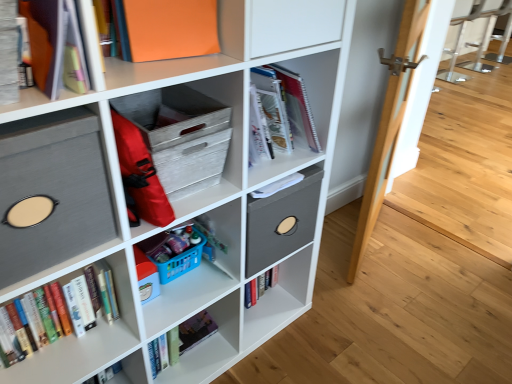
The image size is (512, 384). Describe the element at coordinates (53, 190) in the screenshot. I see `gray fabric storage bin at left, placed as the second shelf when sorted from bottom to top` at that location.

What is the approximate width of wooden crate at center, placed as the second shelf when sorted from top to bottom?

It is 35.37 centimeters.

What is the approximate height of wooden crate at center, acting as the third shelf starting from the bottom?

21.55 centimeters.

The image size is (512, 384). Identify the location of orange matte paper at upper center. (170, 28).

Find the location of a particular element. gray fabric storage bin at left, placed as the second shelf when sorted from bottom to top is located at coordinates (53, 190).

How many degrees apart are the facing directions of matte orange folder at upper left, the first shelf viewed from the top, and orange matte paper at upper center?

17.2 degrees.

Which object is thinner, matte orange folder at upper left, marked as the 4th shelf in a bottom-to-top arrangement, or orange matte paper at upper center?

Thinner between the two is orange matte paper at upper center.

Considering the positions of objects matte orange folder at upper left, the first shelf viewed from the top, and orange matte paper at upper center in the image provided, who is more to the right, matte orange folder at upper left, the first shelf viewed from the top, or orange matte paper at upper center?

orange matte paper at upper center.

Which of these two, matte orange folder at upper left, the first shelf viewed from the top, or orange matte paper at upper center, is smaller?

orange matte paper at upper center is smaller.

Which is more to the right, wooden crate at center, placed as the second shelf when sorted from top to bottom, or gray fabric storage bin at left, placed as the second shelf when sorted from bottom to top?

Positioned to the right is wooden crate at center, placed as the second shelf when sorted from top to bottom.

Considering the sizes of objects wooden crate at center, acting as the third shelf starting from the bottom, and gray fabric storage bin at left, placed as the second shelf when sorted from bottom to top, in the image provided, who is bigger, wooden crate at center, acting as the third shelf starting from the bottom, or gray fabric storage bin at left, placed as the second shelf when sorted from bottom to top,?

Bigger between the two is gray fabric storage bin at left, placed as the second shelf when sorted from bottom to top.

Could you tell me if wooden crate at center, placed as the second shelf when sorted from top to bottom, is turned towards gray fabric storage bin at left, placed as the second shelf when sorted from bottom to top?

No, wooden crate at center, placed as the second shelf when sorted from top to bottom, is not aimed at gray fabric storage bin at left, placed as the second shelf when sorted from bottom to top.

In terms of size, does orange matte paper at upper center appear bigger or smaller than wooden crate at center, placed as the second shelf when sorted from top to bottom?

In the image, orange matte paper at upper center appears to be smaller than wooden crate at center, placed as the second shelf when sorted from top to bottom.

Considering the sizes of orange matte paper at upper center and wooden crate at center, acting as the third shelf starting from the bottom, in the image, is orange matte paper at upper center wider or thinner than wooden crate at center, acting as the third shelf starting from the bottom,?

In the image, orange matte paper at upper center appears to be more narrow than wooden crate at center, acting as the third shelf starting from the bottom.

Consider the image. Can you tell me how much orange matte paper at upper center and wooden crate at center, acting as the third shelf starting from the bottom, differ in facing direction?

The angle between the facing direction of orange matte paper at upper center and the facing direction of wooden crate at center, acting as the third shelf starting from the bottom, is 18.8 degrees.

Considering the relative sizes of gray fabric storage bin at left, which ranks as the third shelf in top-to-bottom order, and matte gray fabric storage cube at upper left, arranged as the first shelf when ordered from the bottom, in the image provided, is gray fabric storage bin at left, which ranks as the third shelf in top-to-bottom order, wider than matte gray fabric storage cube at upper left, arranged as the first shelf when ordered from the bottom,?

Incorrect, the width of gray fabric storage bin at left, which ranks as the third shelf in top-to-bottom order, does not surpass that of matte gray fabric storage cube at upper left, arranged as the first shelf when ordered from the bottom.

From the image's perspective, is gray fabric storage bin at left, which ranks as the third shelf in top-to-bottom order, below matte gray fabric storage cube at upper left, arranged as the first shelf when ordered from the bottom?

No, from the image's perspective, gray fabric storage bin at left, which ranks as the third shelf in top-to-bottom order, is not beneath matte gray fabric storage cube at upper left, arranged as the first shelf when ordered from the bottom.

Who is more distant, gray fabric storage bin at left, placed as the second shelf when sorted from bottom to top, or matte gray fabric storage cube at upper left, the fourth shelf in the top-to-bottom sequence?

gray fabric storage bin at left, placed as the second shelf when sorted from bottom to top, is behind.

How distant is gray fabric storage bin at left, which ranks as the third shelf in top-to-bottom order, from matte gray fabric storage cube at upper left, the fourth shelf in the top-to-bottom sequence?

gray fabric storage bin at left, which ranks as the third shelf in top-to-bottom order, is 25.41 centimeters from matte gray fabric storage cube at upper left, the fourth shelf in the top-to-bottom sequence.

This screenshot has width=512, height=384. Identify the location of the 3rd shelf above the matte gray fabric storage cube at upper left, arranged as the first shelf when ordered from the bottom (from a real-world perspective). (65, 90).

Does matte orange folder at upper left, marked as the 4th shelf in a bottom-to-top arrangement, touch matte gray fabric storage cube at upper left, the fourth shelf in the top-to-bottom sequence?

matte orange folder at upper left, marked as the 4th shelf in a bottom-to-top arrangement, and matte gray fabric storage cube at upper left, the fourth shelf in the top-to-bottom sequence, are not in contact.

Who is taller, matte orange folder at upper left, marked as the 4th shelf in a bottom-to-top arrangement, or matte gray fabric storage cube at upper left, arranged as the first shelf when ordered from the bottom?

Standing taller between the two is matte gray fabric storage cube at upper left, arranged as the first shelf when ordered from the bottom.

From the image's perspective, between matte orange folder at upper left, the first shelf viewed from the top, and matte gray fabric storage cube at upper left, the fourth shelf in the top-to-bottom sequence, who is located below?

matte gray fabric storage cube at upper left, the fourth shelf in the top-to-bottom sequence.

Between hardcover books at left and orange matte paper at upper center, which one has larger width?

Wider between the two is hardcover books at left.

How many degrees apart are the facing directions of hardcover books at left and orange matte paper at upper center?

18.6 degrees separate the facing orientations of hardcover books at left and orange matte paper at upper center.

Is point (14, 321) positioned in front of point (209, 0)?

No, (14, 321) is behind (209, 0).

Is hardcover books at left turned away from orange matte paper at upper center?

That's not correct — hardcover books at left is not looking away from orange matte paper at upper center.

From the image's perspective, is gray fabric storage bin at left, placed as the second shelf when sorted from bottom to top, located above wooden crate at center, placed as the second shelf when sorted from top to bottom?

Actually, gray fabric storage bin at left, placed as the second shelf when sorted from bottom to top, appears below wooden crate at center, placed as the second shelf when sorted from top to bottom, in the image.

Is gray fabric storage bin at left, which ranks as the third shelf in top-to-bottom order, positioned with its back to wooden crate at center, placed as the second shelf when sorted from top to bottom?

No, gray fabric storage bin at left, which ranks as the third shelf in top-to-bottom order, is not facing the opposite direction of wooden crate at center, placed as the second shelf when sorted from top to bottom.

From the picture: From a real-world perspective, is gray fabric storage bin at left, which ranks as the third shelf in top-to-bottom order, physically located above or below wooden crate at center, placed as the second shelf when sorted from top to bottom?

From a real-world perspective, gray fabric storage bin at left, which ranks as the third shelf in top-to-bottom order, is physically above wooden crate at center, placed as the second shelf when sorted from top to bottom.

Locate an element on the screen. paperback book above the matte orange folder at upper left, the first shelf viewed from the top (from a real-world perspective) is located at coordinates (170, 28).

Identify the location of the 3rd shelf to the right of the gray fabric storage bin at left, placed as the second shelf when sorted from bottom to top, starting your count from the anchor. The width and height of the screenshot is (512, 384). (191, 136).

Based on their spatial positions, is matte orange folder at upper left, the first shelf viewed from the top, or orange matte paper at upper center closer to matte gray fabric storage cube at upper left, arranged as the first shelf when ordered from the bottom?

orange matte paper at upper center is positioned closer to the anchor matte gray fabric storage cube at upper left, arranged as the first shelf when ordered from the bottom.

Which object lies nearer to the anchor point gray fabric storage bin at left, placed as the second shelf when sorted from bottom to top, matte orange folder at upper left, the first shelf viewed from the top, or hardcover books at left?

Based on the image, matte orange folder at upper left, the first shelf viewed from the top, appears to be nearer to gray fabric storage bin at left, placed as the second shelf when sorted from bottom to top.

From the image, which object appears to be nearer to gray fabric storage bin at left, which ranks as the third shelf in top-to-bottom order, wooden crate at center, acting as the third shelf starting from the bottom, or hardcover books at left?

Result: wooden crate at center, acting as the third shelf starting from the bottom, is closer to gray fabric storage bin at left, which ranks as the third shelf in top-to-bottom order.

When comparing their distances from wooden crate at center, acting as the third shelf starting from the bottom, does orange matte paper at upper center or matte gray fabric storage cube at upper left, arranged as the first shelf when ordered from the bottom, seem closer?

The object closer to wooden crate at center, acting as the third shelf starting from the bottom, is matte gray fabric storage cube at upper left, arranged as the first shelf when ordered from the bottom.

Based on their spatial positions, is gray fabric storage bin at left, which ranks as the third shelf in top-to-bottom order, or matte orange folder at upper left, marked as the 4th shelf in a bottom-to-top arrangement, further from wooden crate at center, acting as the third shelf starting from the bottom?

matte orange folder at upper left, marked as the 4th shelf in a bottom-to-top arrangement, is further to wooden crate at center, acting as the third shelf starting from the bottom.

Estimate the real-world distances between objects in this image. Which object is further from gray fabric storage bin at left, placed as the second shelf when sorted from bottom to top, wooden crate at center, acting as the third shelf starting from the bottom, or matte orange folder at upper left, the first shelf viewed from the top?

wooden crate at center, acting as the third shelf starting from the bottom.

Looking at this image, when comparing their distances from wooden crate at center, placed as the second shelf when sorted from top to bottom, does gray fabric storage bin at left, placed as the second shelf when sorted from bottom to top, or matte gray fabric storage cube at upper left, arranged as the first shelf when ordered from the bottom, seem closer?

matte gray fabric storage cube at upper left, arranged as the first shelf when ordered from the bottom, is closer to wooden crate at center, placed as the second shelf when sorted from top to bottom.

Looking at the image, which one is located closer to gray fabric storage bin at left, which ranks as the third shelf in top-to-bottom order, hardcover books at left or orange matte paper at upper center?

hardcover books at left is positioned closer to the anchor gray fabric storage bin at left, which ranks as the third shelf in top-to-bottom order.

Locate an element on the screen. The height and width of the screenshot is (384, 512). paperback book between matte orange folder at upper left, marked as the 4th shelf in a bottom-to-top arrangement, and wooden crate at center, placed as the second shelf when sorted from top to bottom, in the front-back direction is located at coordinates (170, 28).

Identify the location of shelf between matte orange folder at upper left, the first shelf viewed from the top, and wooden crate at center, placed as the second shelf when sorted from top to bottom, from front to back. This screenshot has width=512, height=384. (53, 190).